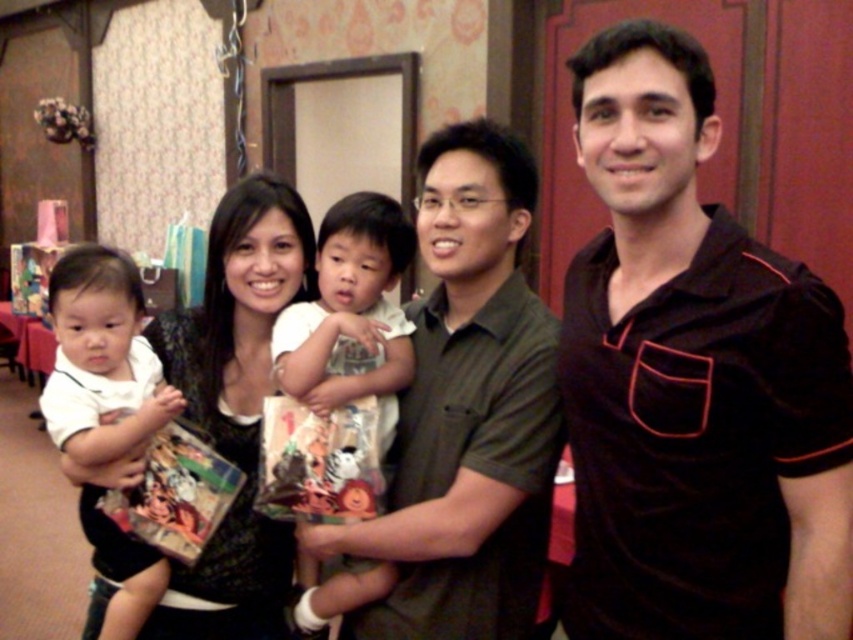
You are a photographer trying to capture a clear photo of the white cotton shirt at center and the white matte shirt at center. Which one is closer to the camera?

The white matte shirt at center is closer to the camera than the white cotton shirt at center because the white cotton shirt at center is behind the white matte shirt at center.

You are a photographer taking a picture of the black velvety shirt at center and the white cotton shirt at center. Which one do you need to focus on first if you want to ensure both are in focus?

You should focus on the black velvety shirt at center first because it is closer to the viewer than the white cotton shirt at center, so adjusting focus from near to far will help both be in focus.

What is located at the coordinates point (102,358)?

The white matte shirt at center is located at point (102,358).